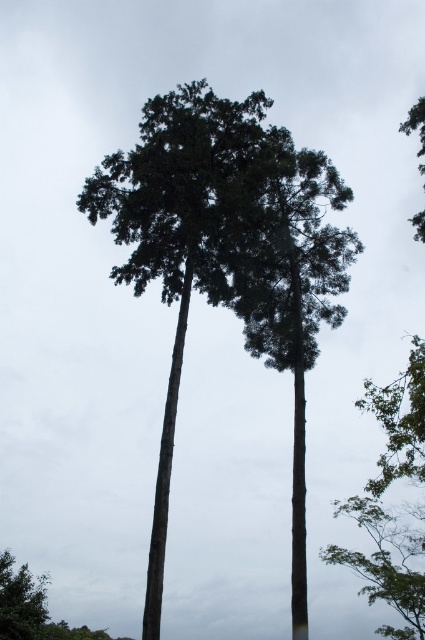
Question: Which point is closer to the camera?

Choices:
 (A) (238, 104)
 (B) (311, 292)

Answer: (A)

Question: Is green leafy palm tree at center to the left of green textured palm tree at center from the viewer's perspective?

Choices:
 (A) no
 (B) yes

Answer: (B)

Question: Can you confirm if green leafy palm tree at center is positioned to the left of green textured palm tree at center?

Choices:
 (A) yes
 (B) no

Answer: (A)

Question: Is green leafy palm tree at center wider than green textured palm tree at center?

Choices:
 (A) no
 (B) yes

Answer: (B)

Question: Which object is farther from the camera taking this photo?

Choices:
 (A) green textured palm tree at center
 (B) green leafy palm tree at center

Answer: (A)

Question: Which of the following is the closest to the observer?

Choices:
 (A) green textured palm tree at center
 (B) green leafy palm tree at center

Answer: (B)